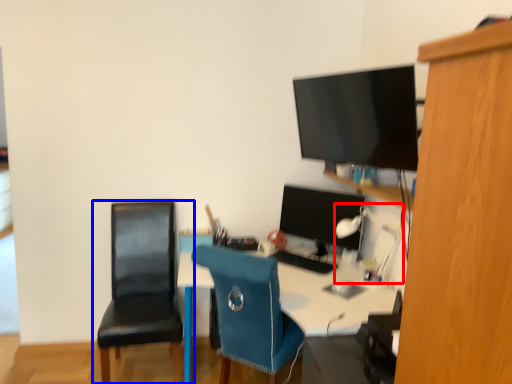
Question: Which point is closer to the camera, lamp (highlighted by a red box) or chair (highlighted by a blue box)?

Choices:
 (A) lamp
 (B) chair

Answer: (B)